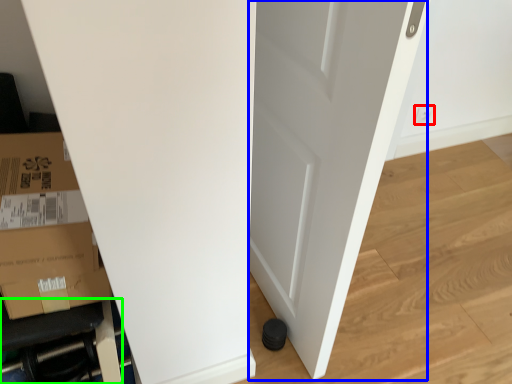
Question: Considering the real-world distances, which object is farthest from electric outlet (highlighted by a red box)? door (highlighted by a blue box) or furniture (highlighted by a green box)?

Choices:
 (A) door
 (B) furniture

Answer: (B)